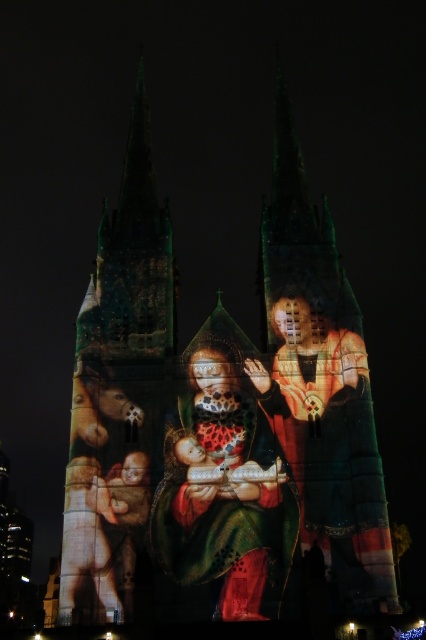
Question: Can you confirm if matte gold and red fabric at center is positioned above matte gold robe at center?

Choices:
 (A) no
 (B) yes

Answer: (A)

Question: Can you confirm if matte gold and red fabric at center is positioned above matte gold robe at center?

Choices:
 (A) yes
 (B) no

Answer: (B)

Question: Among these objects, which one is nearest to the camera?

Choices:
 (A) matte gold robe at center
 (B) matte gold and red fabric at center

Answer: (A)

Question: Which point is closer to the camera?

Choices:
 (A) matte gold and red fabric at center
 (B) matte gold robe at center

Answer: (B)

Question: Does matte gold and red fabric at center have a larger size compared to matte gold robe at center?

Choices:
 (A) no
 (B) yes

Answer: (A)